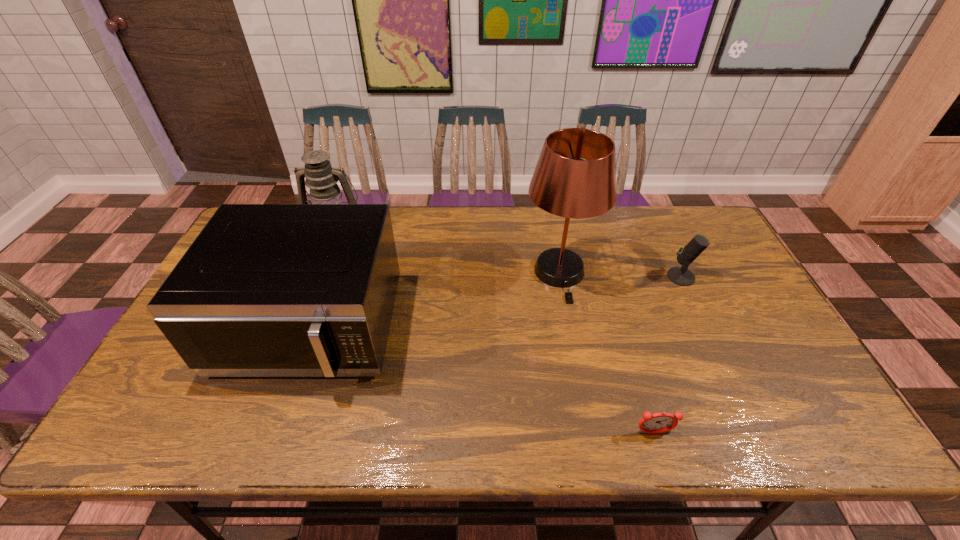
Find the location of a particular element. vacant area situated on the left of the rightmost object is located at coordinates (558, 276).

Identify the location of lampshade that is positioned at the far edge. (575, 177).

The width and height of the screenshot is (960, 540). I want to click on oil lamp at the far edge, so click(x=321, y=178).

What are the coordinates of `object present at the near edge` in the screenshot? It's located at (656, 423).

Locate an element on the screen. object that is at the left edge is located at coordinates (265, 290).

Identify the location of object located at the right edge. This screenshot has height=540, width=960. (681, 276).

Where is `free space at the far edge of the desktop`? free space at the far edge of the desktop is located at coordinates (578, 221).

Locate an element on the screen. This screenshot has width=960, height=540. free region at the near edge is located at coordinates [546, 409].

You are a GUI agent. You are given a task and a screenshot of the screen. Output one action in this format:
    pyautogui.click(x=<x>, y=<y>)
    Task: Click on the blank space at the right edge of the desktop
    The width and height of the screenshot is (960, 540).
    Given the screenshot: What is the action you would take?
    pyautogui.click(x=732, y=294)

Locate an element on the screen. vacant space at the far right corner of the desktop is located at coordinates (711, 226).